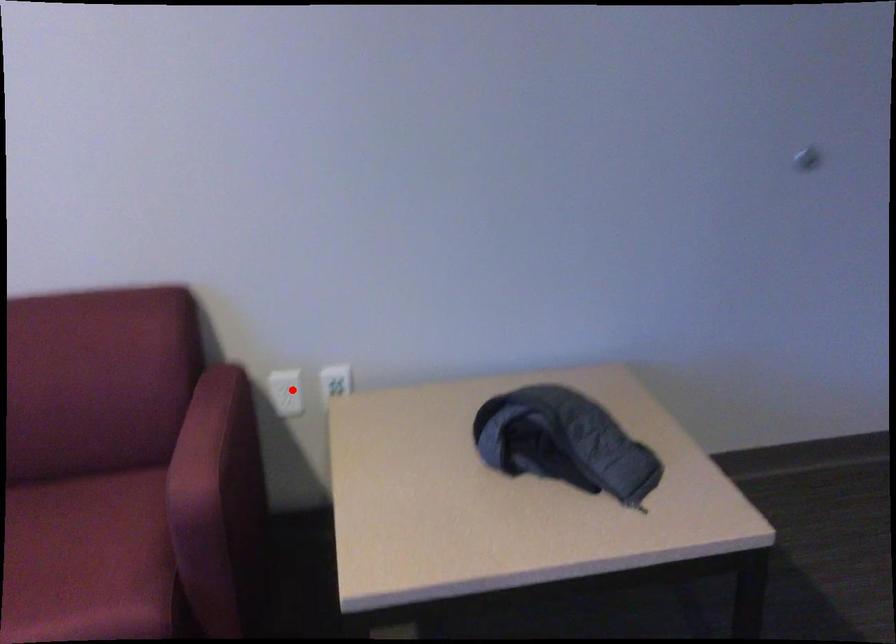
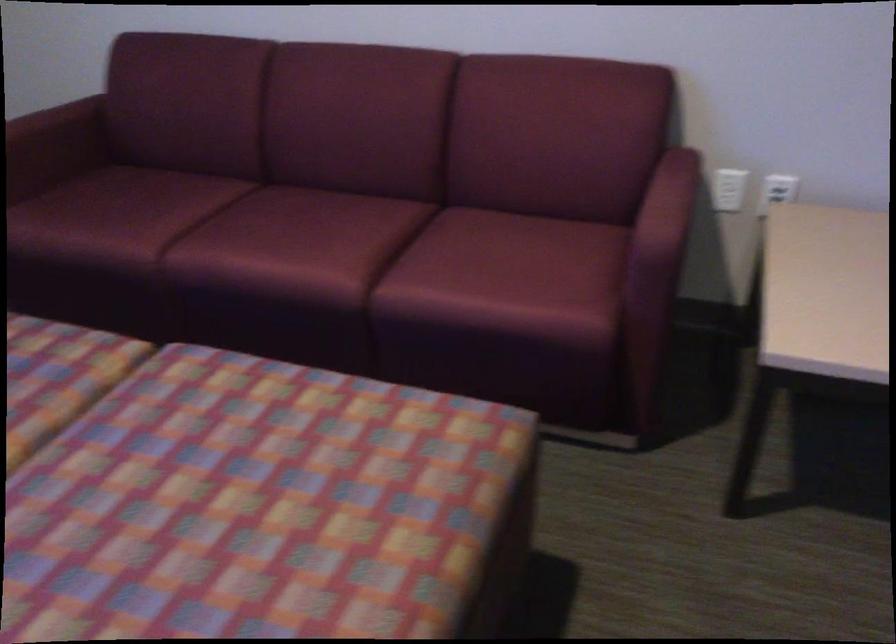
The point at the highlighted location is marked in the first image. Where is the corresponding point in the second image?

(728, 189)